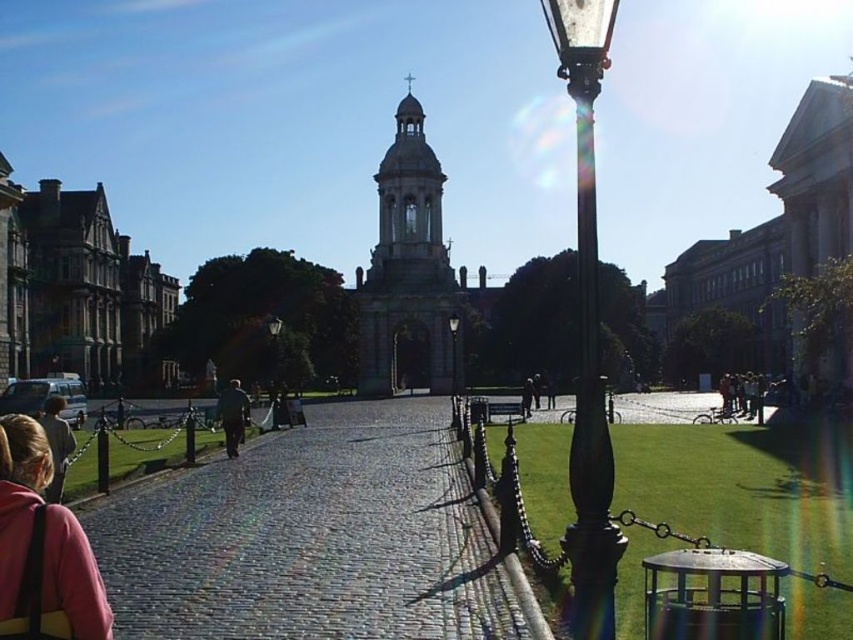
Who is taller, light brown leather jacket at lower left or metallic street light at center?

metallic street light at center is taller.

Between point (50, 440) and point (273, 358), which one is positioned behind?

The point (273, 358) is behind.

Where is `light brown leather jacket at lower left`? Image resolution: width=853 pixels, height=640 pixels. light brown leather jacket at lower left is located at coordinates (56, 444).

Who is more forward, (42, 422) or (453, 388)?

Positioned in front is point (42, 422).

Between light brown leather jacket at lower left and polished brass street light at center, which one is positioned higher?

polished brass street light at center is higher up.

Does point (51, 497) come closer to viewer compared to point (456, 380)?

Yes, point (51, 497) is closer to viewer.

Find the location of a particular element. The width and height of the screenshot is (853, 640). light brown leather jacket at lower left is located at coordinates (56, 444).

Does black polished metal street light at center right appear on the left side of metallic street light at center?

No, black polished metal street light at center right is not to the left of metallic street light at center.

Between point (577, 627) and point (273, 320), which one is positioned behind?

Positioned behind is point (273, 320).

Is point (579, 64) closer to viewer compared to point (279, 387)?

Yes.

Identify the location of black polished metal street light at center right. Image resolution: width=853 pixels, height=640 pixels. (587, 330).